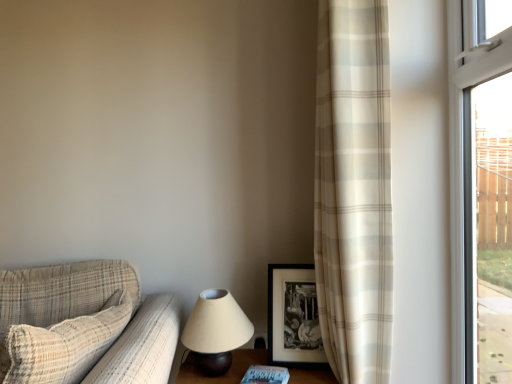
Question: Considering the relative positions of matte beige lampshade at lower center and white matte book at lower center in the image provided, is matte beige lampshade at lower center to the right of white matte book at lower center from the viewer's perspective?

Choices:
 (A) yes
 (B) no

Answer: (B)

Question: Are matte beige lampshade at lower center and white matte book at lower center far apart?

Choices:
 (A) yes
 (B) no

Answer: (B)

Question: Is matte beige lampshade at lower center further to the viewer compared to white matte book at lower center?

Choices:
 (A) no
 (B) yes

Answer: (B)

Question: Is matte beige lampshade at lower center positioned in front of white matte book at lower center?

Choices:
 (A) no
 (B) yes

Answer: (A)

Question: Is matte beige lampshade at lower center taller than white matte book at lower center?

Choices:
 (A) no
 (B) yes

Answer: (B)

Question: From a real-world perspective, is transparent glass window at right above or below beige plaid curtain at right?

Choices:
 (A) below
 (B) above

Answer: (A)

Question: Looking at their shapes, would you say transparent glass window at right is wider or thinner than beige plaid curtain at right?

Choices:
 (A) thin
 (B) wide

Answer: (A)

Question: In terms of height, does transparent glass window at right look taller or shorter compared to beige plaid curtain at right?

Choices:
 (A) tall
 (B) short

Answer: (B)

Question: Considering the positions of point (458, 329) and point (379, 236), is point (458, 329) closer or farther from the camera than point (379, 236)?

Choices:
 (A) closer
 (B) farther

Answer: (B)

Question: Considering the positions of matte beige lampshade at lower center and white matte book at lower center in the image, is matte beige lampshade at lower center wider or thinner than white matte book at lower center?

Choices:
 (A) thin
 (B) wide

Answer: (A)

Question: Is matte beige lampshade at lower center in front of or behind white matte book at lower center in the image?

Choices:
 (A) front
 (B) behind

Answer: (B)

Question: From their relative heights in the image, would you say matte beige lampshade at lower center is taller or shorter than white matte book at lower center?

Choices:
 (A) short
 (B) tall

Answer: (B)

Question: Based on their positions, is matte beige lampshade at lower center located to the left or right of white matte book at lower center?

Choices:
 (A) right
 (B) left

Answer: (B)

Question: Is plaid fabric couch at left in front of or behind white matte book at lower center in the image?

Choices:
 (A) behind
 (B) front

Answer: (B)

Question: Is plaid fabric couch at left wider or thinner than white matte book at lower center?

Choices:
 (A) thin
 (B) wide

Answer: (B)